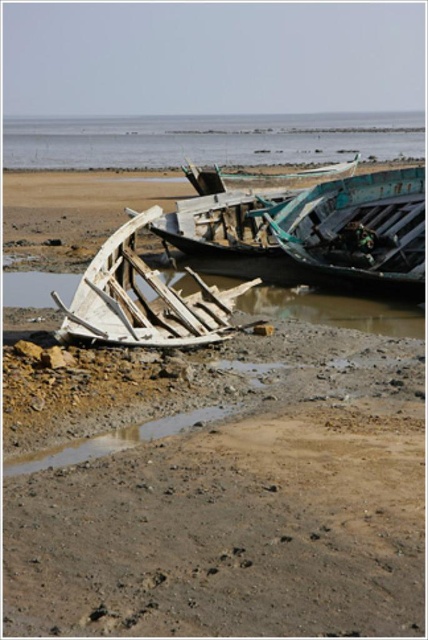
Describe the element at coordinates (357, 230) in the screenshot. I see `teal wooden boat at upper center` at that location.

Is the position of teal wooden boat at upper center less distant than that of white wooden boat at center?

No, it is behind white wooden boat at center.

Describe the element at coordinates (357, 230) in the screenshot. I see `teal wooden boat at upper center` at that location.

Find the location of a particular element. The width and height of the screenshot is (428, 640). teal wooden boat at upper center is located at coordinates [x=357, y=230].

Is clear blue water at upper center further to the viewer compared to wooden planks boat at center?

Yes, it is behind wooden planks boat at center.

Who is shorter, clear blue water at upper center or wooden planks boat at center?

wooden planks boat at center is shorter.

Is point (27, 140) positioned in front of point (240, 211)?

No, it is behind (240, 211).

At what (x,y) coordinates should I click in order to perform the action: click on clear blue water at upper center. Please return your answer as a coordinate pair (x, y). Looking at the image, I should click on (210, 140).

Can you confirm if clear blue water at upper center is taller than teal wooden boat at upper center?

Correct, clear blue water at upper center is much taller as teal wooden boat at upper center.

Which is behind, point (85, 122) or point (400, 272)?

The point (85, 122) is more distant.

Locate an element on the screen. The height and width of the screenshot is (640, 428). clear blue water at upper center is located at coordinates (210, 140).